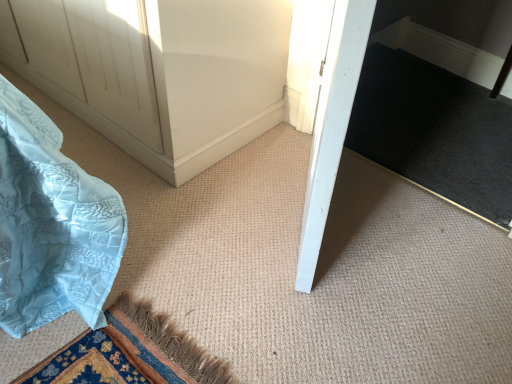
Question: Is the position of white smooth door at center more distant than that of black carpet at center?

Choices:
 (A) no
 (B) yes

Answer: (A)

Question: Would you say white smooth door at center contains black carpet at center?

Choices:
 (A) no
 (B) yes

Answer: (A)

Question: From the image's perspective, is white smooth door at center over black carpet at center?

Choices:
 (A) no
 (B) yes

Answer: (A)

Question: Is white smooth door at center shorter than black carpet at center?

Choices:
 (A) yes
 (B) no

Answer: (B)

Question: From a real-world perspective, is white smooth door at center physically below black carpet at center?

Choices:
 (A) no
 (B) yes

Answer: (A)

Question: Are white smooth door at center and black carpet at center located far from each other?

Choices:
 (A) yes
 (B) no

Answer: (B)

Question: Can you confirm if black carpet at center is positioned to the left of white smooth door at center?

Choices:
 (A) yes
 (B) no

Answer: (B)

Question: From the image's perspective, is black carpet at center below white smooth door at center?

Choices:
 (A) yes
 (B) no

Answer: (B)

Question: Does black carpet at center have a smaller size compared to white smooth door at center?

Choices:
 (A) yes
 (B) no

Answer: (A)

Question: Does black carpet at center come in front of white smooth door at center?

Choices:
 (A) yes
 (B) no

Answer: (B)

Question: Considering the relative sizes of black carpet at center and white smooth door at center in the image provided, is black carpet at center thinner than white smooth door at center?

Choices:
 (A) yes
 (B) no

Answer: (B)

Question: From a real-world perspective, is black carpet at center under white smooth door at center?

Choices:
 (A) yes
 (B) no

Answer: (A)

Question: In the image, is white smooth door at center on the left side or the right side of black carpet at center?

Choices:
 (A) right
 (B) left

Answer: (B)